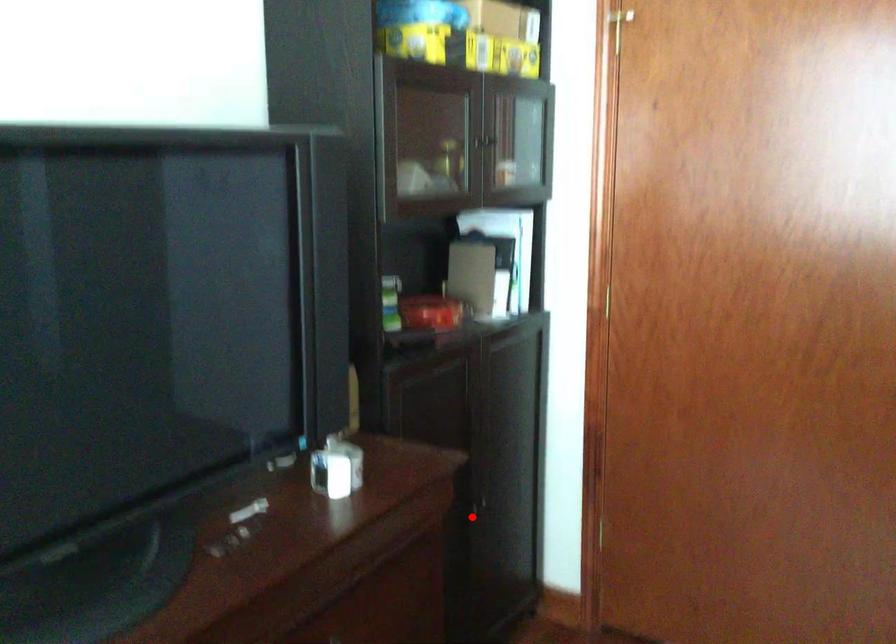
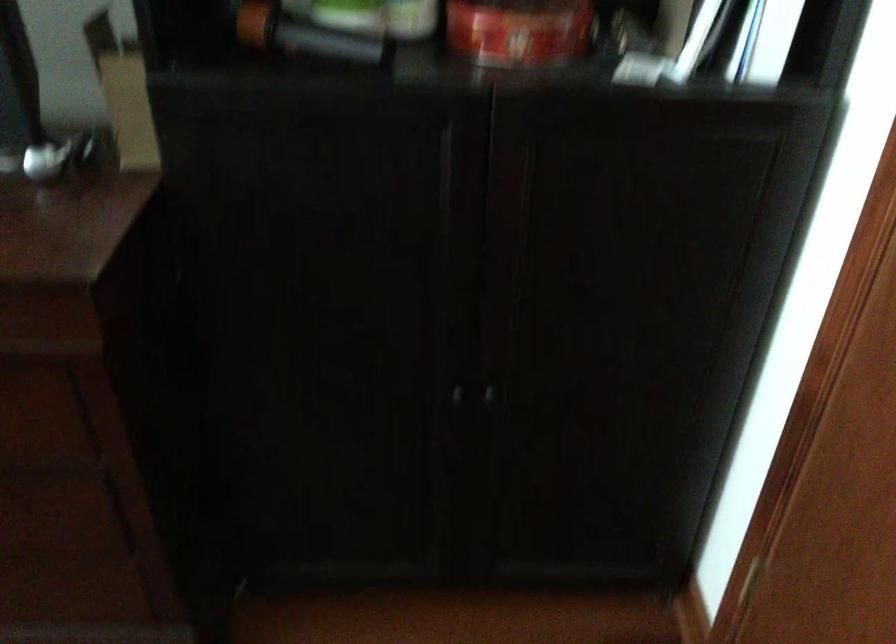
Locate, in the second image, the point that corresponds to the highlighted location in the first image.

(457, 395)